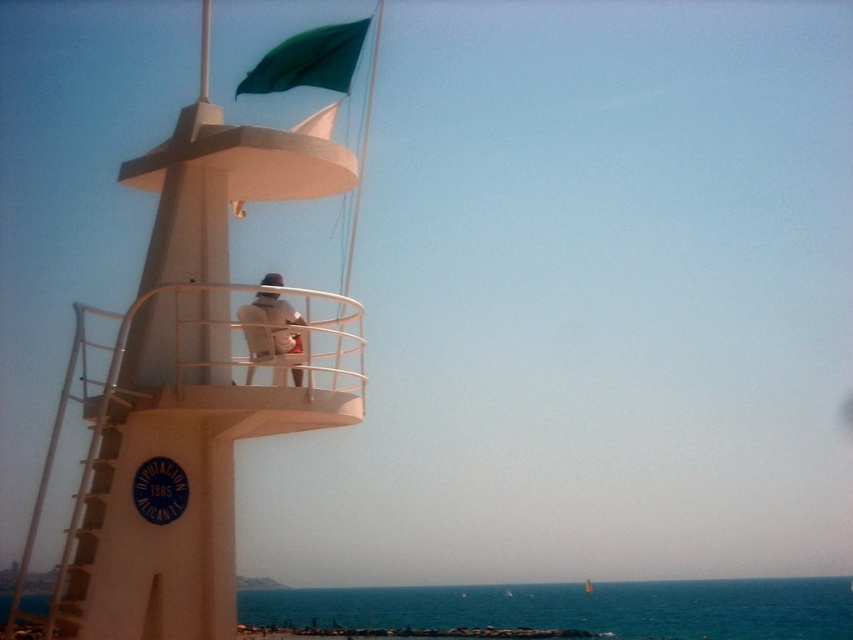
You are a swimmer who wants to retrieve your light brown leather jacket at center from the lifeguard station. The flag, green fabric flag at upper center, is in the way. How can you reach your jacket without touching the flag?

The light brown leather jacket at center is behind the green fabric flag at upper center, so you can reach the jacket by going around the flag to access it from behind.

You are a drone operator tasked with capturing aerial footage of the beach. The white matte tower at center is your main subject. From which direction should you approach to ensure the tower is fully visible without obstruction from the ocean waves?

The white matte tower at center is located at point (190, 387), so you should approach from the land side to ensure the tower is fully visible without obstruction from the ocean waves.

You are a beach visitor who wants to retrieve your light brown leather jacket at center from the lifeguard station. The green fabric flag at upper center is in the way. Can you reach the jacket without moving the flag?

The green fabric flag at upper center is above the light brown leather jacket at center, so you can reach the jacket without moving the flag since it is below the flag.